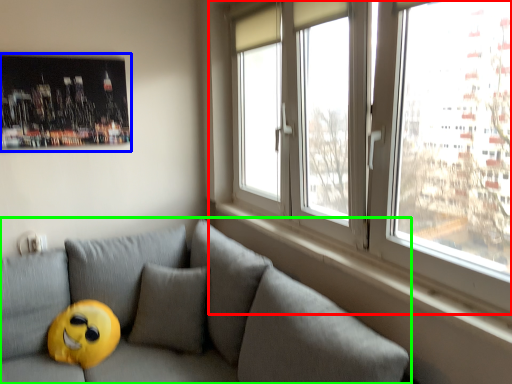
Question: Based on their relative distances, which object is nearer to window (highlighted by a red box)? Choose from picture frame (highlighted by a blue box) and studio couch (highlighted by a green box).

Choices:
 (A) picture frame
 (B) studio couch

Answer: (B)